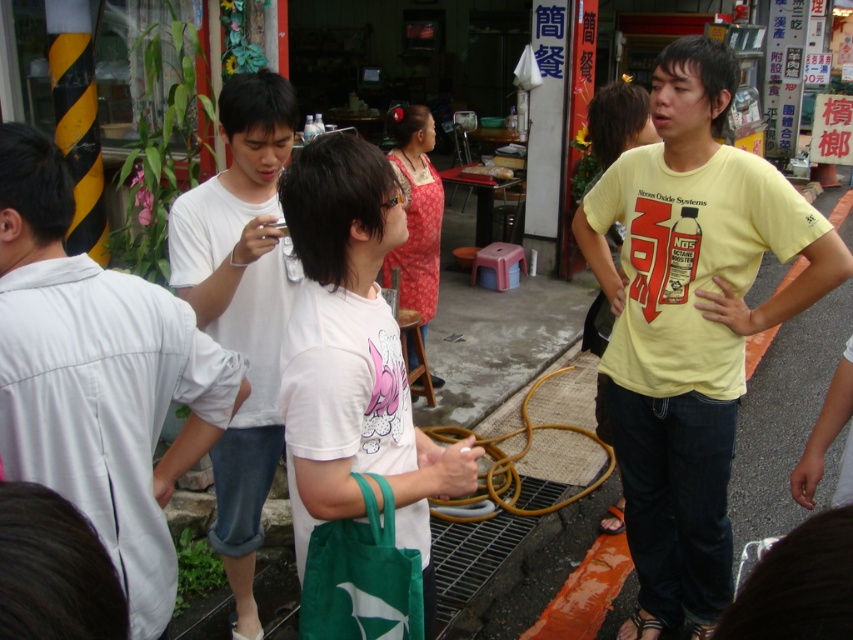
Which is more to the right, white cotton t-shirt at center or green fabric bag at lower center?

green fabric bag at lower center

Which is behind, point (178, 275) or point (318, 596)?

Point (178, 275)

At what (x,y) coordinates should I click in order to perform the action: click on white cotton t-shirt at center. Please return your answer as a coordinate pair (x, y). The width and height of the screenshot is (853, 640). Looking at the image, I should click on (242, 307).

Is yellow cotton t-shirt at right positioned in front of white cotton shirt at left?

No, yellow cotton t-shirt at right is further to the viewer.

Does yellow cotton t-shirt at right appear under white cotton shirt at left?

Actually, yellow cotton t-shirt at right is above white cotton shirt at left.

This screenshot has height=640, width=853. I want to click on yellow cotton t-shirt at right, so click(689, 324).

Locate an element on the screen. This screenshot has width=853, height=640. yellow cotton t-shirt at right is located at coordinates (x=689, y=324).

Does white cotton shirt at left have a greater width compared to white matte t-shirt at center?

Incorrect, white cotton shirt at left's width does not surpass white matte t-shirt at center's.

Can you confirm if white cotton shirt at left is taller than white matte t-shirt at center?

Incorrect, white cotton shirt at left's height is not larger of white matte t-shirt at center's.

I want to click on white cotton shirt at left, so click(x=97, y=378).

The width and height of the screenshot is (853, 640). What are the coordinates of `white cotton shirt at left` in the screenshot? It's located at (97, 378).